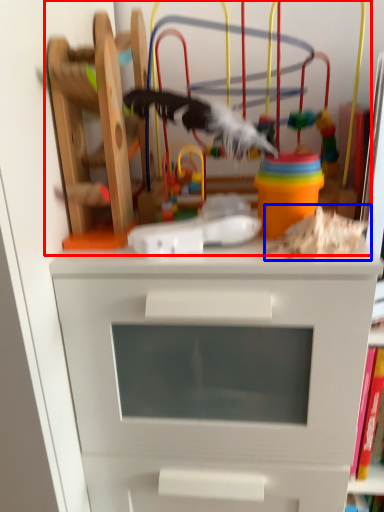
Question: Which of the following is the farthest to the observer, toy (highlighted by a red box) or toy (highlighted by a blue box)?

Choices:
 (A) toy
 (B) toy

Answer: (A)